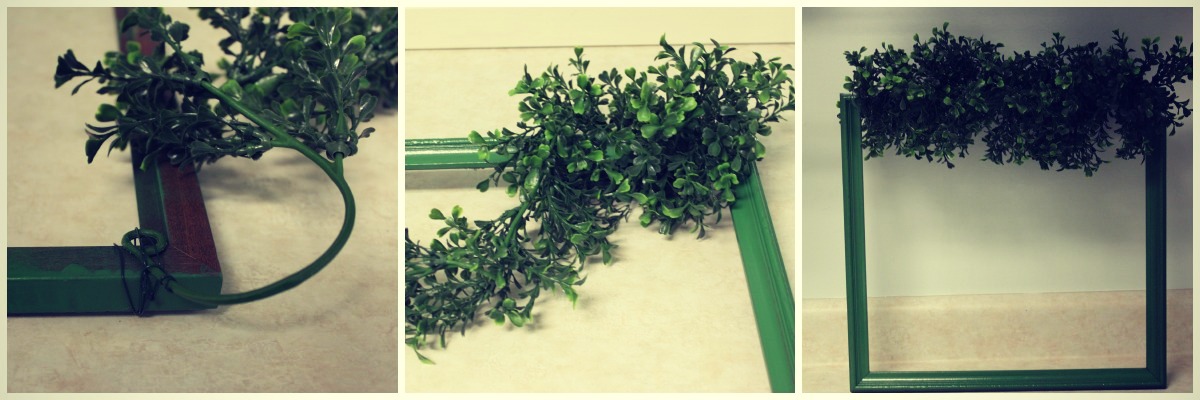
Image resolution: width=1200 pixels, height=400 pixels. I want to click on 1 plank surface, so click(x=464, y=50).